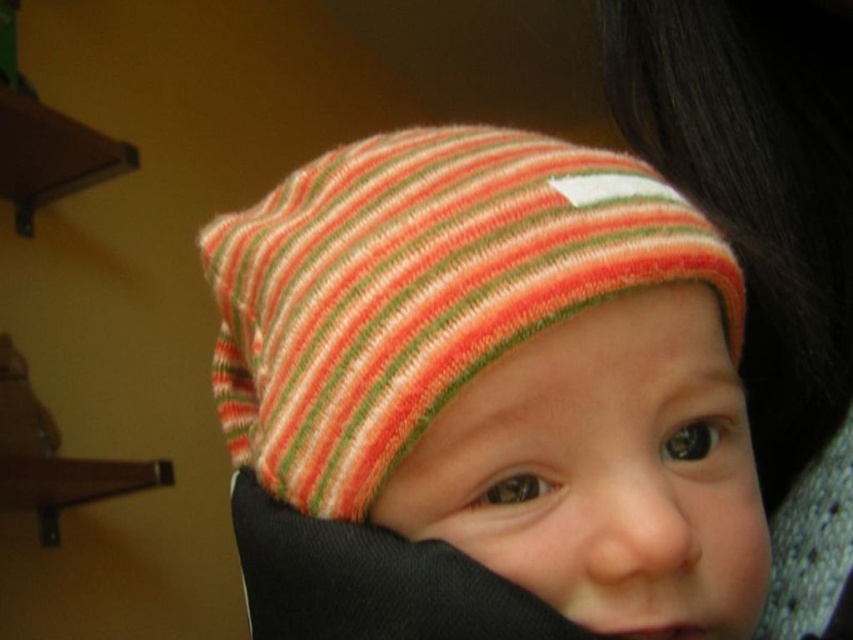
Which is more to the right, striped knit hat at center or striped knit hat at upper center?

striped knit hat at upper center

Is striped knit hat at center above striped knit hat at upper center?

Actually, striped knit hat at center is below striped knit hat at upper center.

Locate an element on the screen. This screenshot has height=640, width=853. striped knit hat at center is located at coordinates (498, 368).